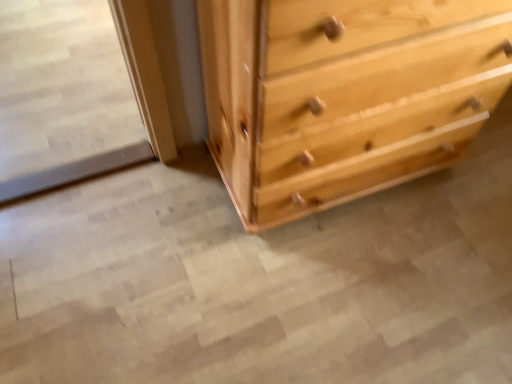
At what (x,y) coordinates should I click in order to perform the action: click on vacant space positioned to the left of natural wood chest of drawers at center. Please return your answer as a coordinate pair (x, y). This screenshot has width=512, height=384. Looking at the image, I should click on (151, 223).